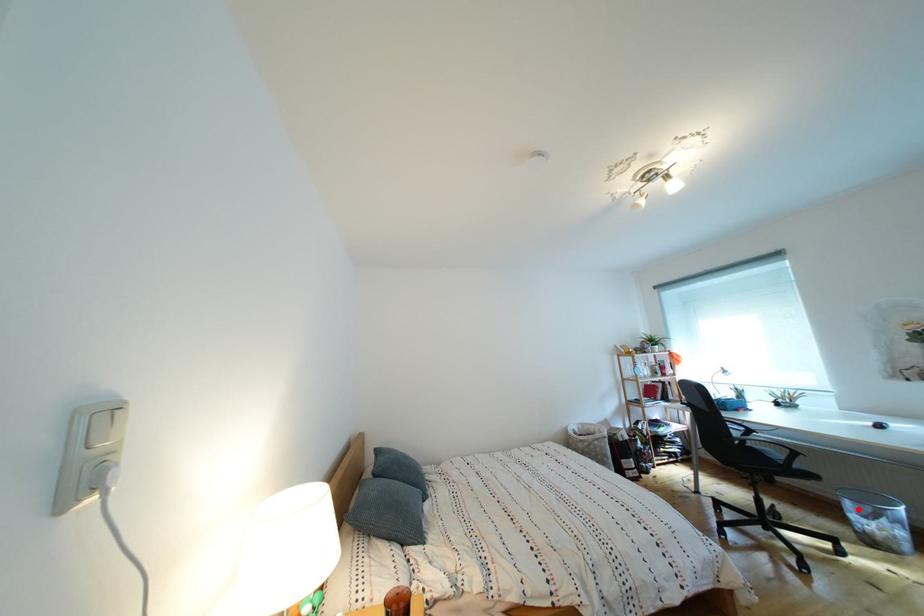
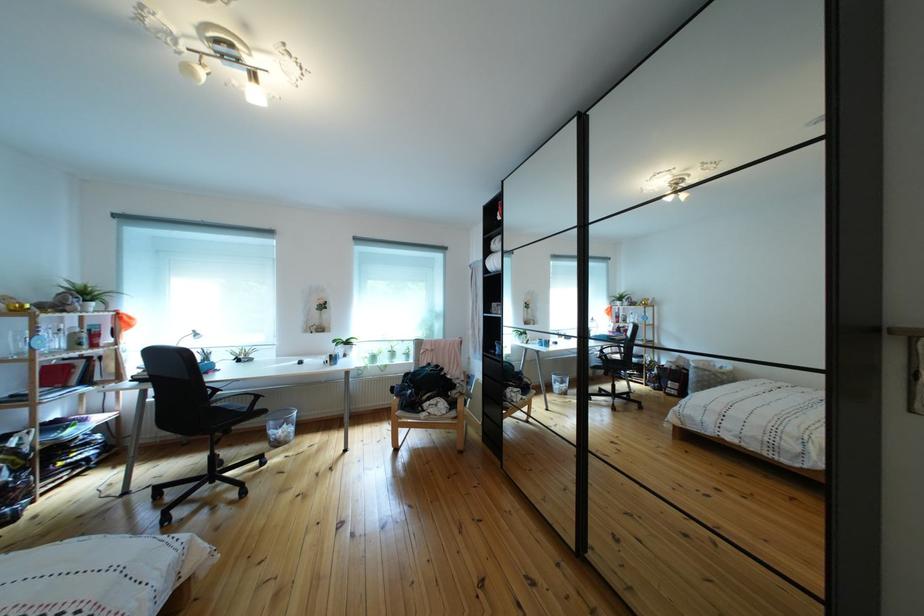
The point at the highlighted location is marked in the first image. Where is the corresponding point in the second image?

(283, 430)